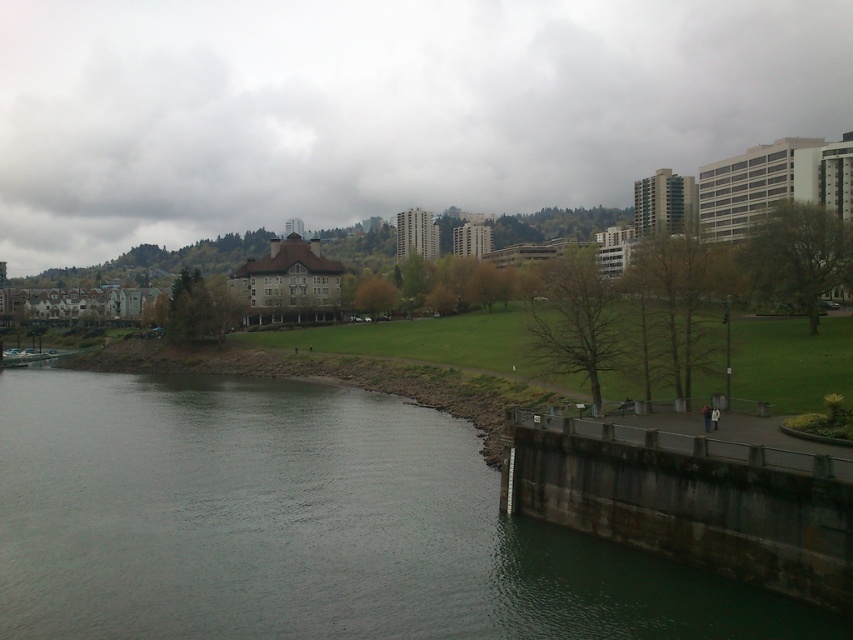
Question: Is dark gray concrete river at lower left above dark gray concrete dam at lower right?

Choices:
 (A) yes
 (B) no

Answer: (B)

Question: Is dark gray concrete river at lower left further to the viewer compared to dark gray concrete dam at lower right?

Choices:
 (A) no
 (B) yes

Answer: (A)

Question: Which object appears closest to the camera in this image?

Choices:
 (A) green grass at center
 (B) dark gray concrete dam at lower right

Answer: (B)

Question: Among these objects, which one is farthest from the camera?

Choices:
 (A) dark gray concrete river at lower left
 (B) green grass at center

Answer: (B)

Question: Estimate the real-world distances between objects in this image. Which object is farther from the dark gray concrete river at lower left?

Choices:
 (A) dark gray concrete dam at lower right
 (B) green grass at center

Answer: (B)

Question: Is green grass at center further to camera compared to dark gray concrete river at lower left?

Choices:
 (A) yes
 (B) no

Answer: (A)